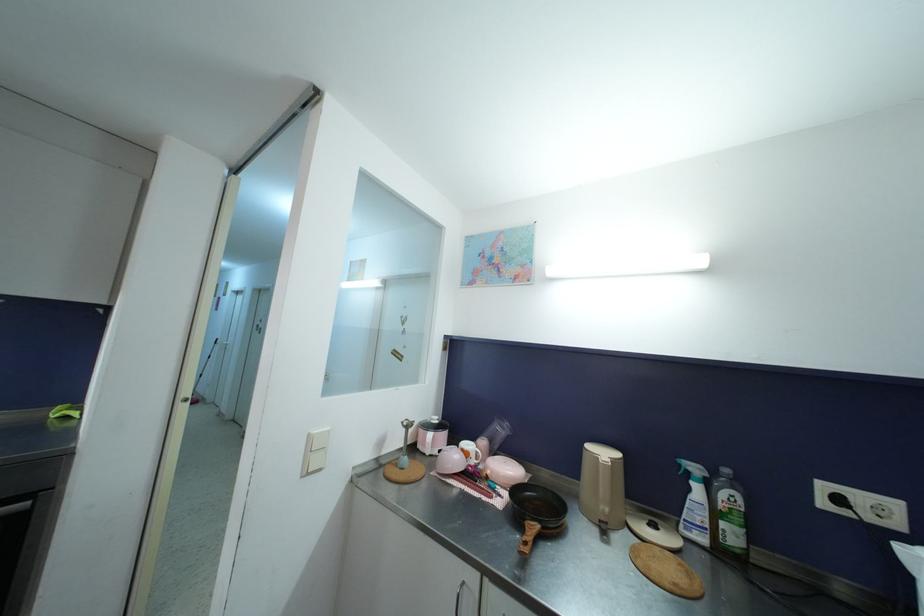
The height and width of the screenshot is (616, 924). In order to click on white mug handle in this screenshot , I will do `click(479, 452)`.